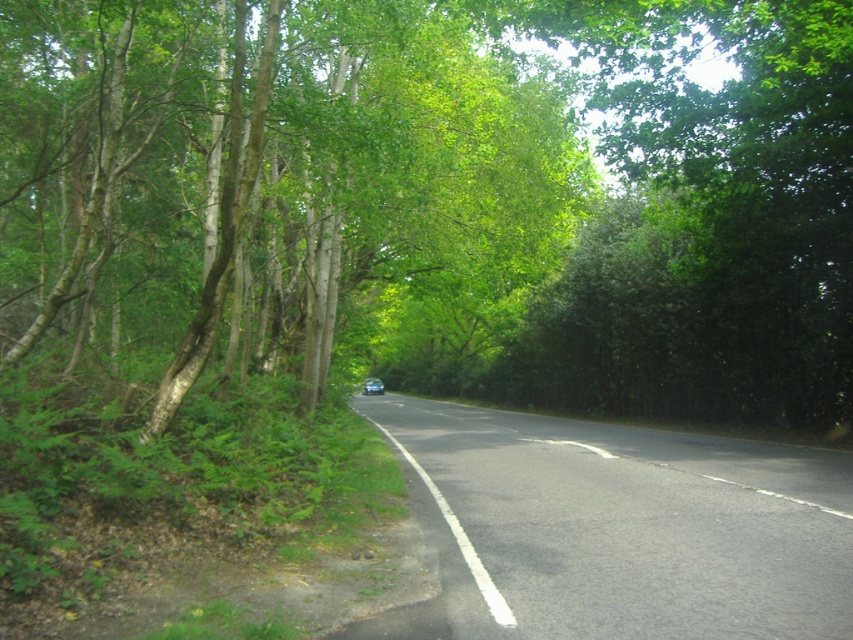
Question: Is green leafy tree at center closer to the viewer compared to metallic blue car at center?

Choices:
 (A) no
 (B) yes

Answer: (B)

Question: Which object is the farthest from the black asphalt road at center?

Choices:
 (A) green leafy tree at center
 (B) metallic blue car at center

Answer: (B)

Question: Does black asphalt road at center have a greater width compared to metallic blue car at center?

Choices:
 (A) no
 (B) yes

Answer: (B)

Question: Estimate the real-world distances between objects in this image. Which object is farther from the black asphalt road at center?

Choices:
 (A) green leafy tree at center
 (B) metallic blue car at center

Answer: (B)

Question: Does black asphalt road at center lie in front of metallic blue car at center?

Choices:
 (A) no
 (B) yes

Answer: (B)

Question: Which of the following is the farthest from the observer?

Choices:
 (A) green leafy tree at center
 (B) metallic blue car at center
 (C) black asphalt road at center

Answer: (B)